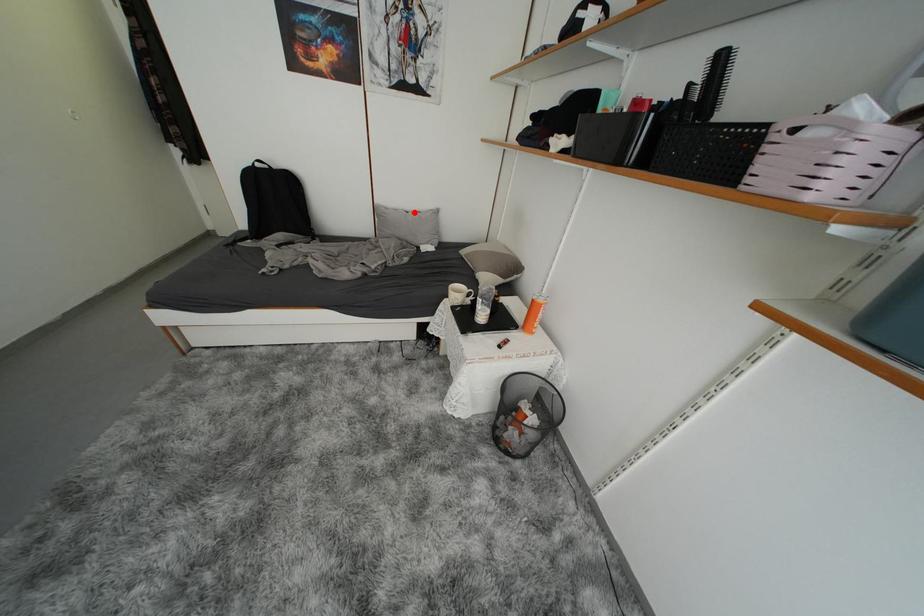
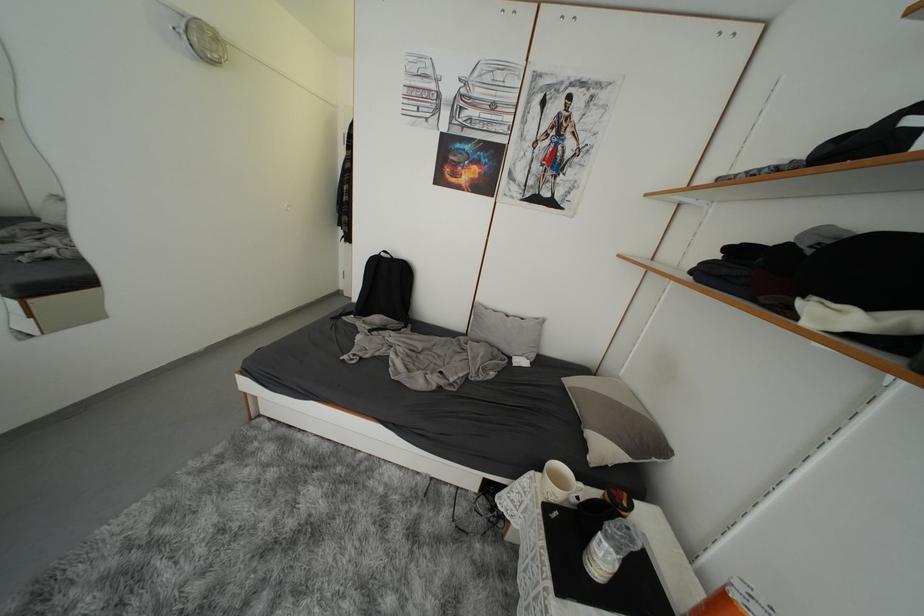
Question: A red point is marked in image1. In image2, is the corresponding 3D point closer to the camera or farther? Reply with the corresponding letter.

Choices:
 (A) The corresponding 3D point is closer.
 (B) The corresponding 3D point is farther.

Answer: (B)